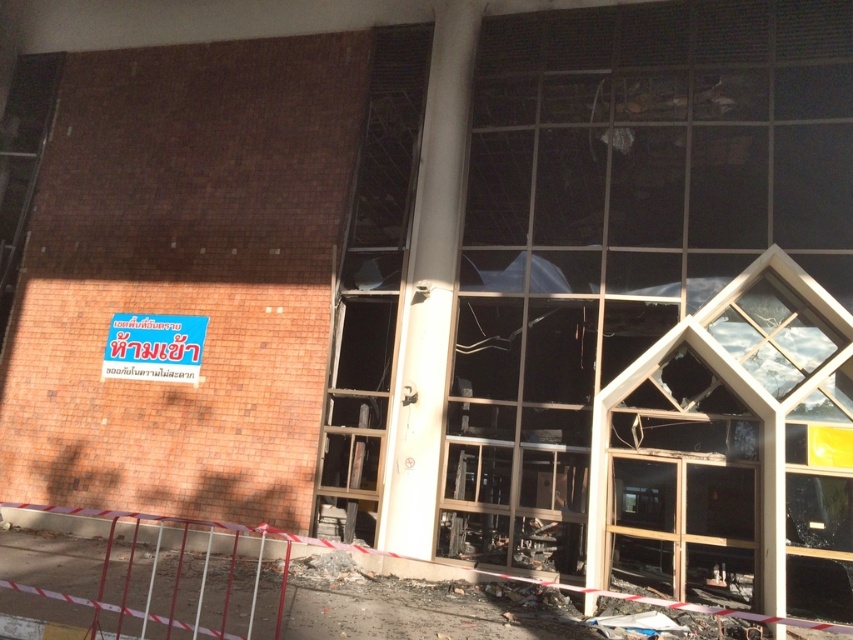
Between transparent glass door at center and blue plastic sign at upper left, which one has more height?

transparent glass door at center is taller.

Which is behind, point (375, 145) or point (143, 346)?

The point (375, 145) is more distant.

What do you see at coordinates (370, 285) in the screenshot? I see `transparent glass door at center` at bounding box center [370, 285].

This screenshot has width=853, height=640. In order to click on transparent glass door at center in this screenshot , I will do `click(370, 285)`.

Is transparent glass window at right closer to camera compared to transparent glass door at center?

Yes, transparent glass window at right is in front of transparent glass door at center.

Who is more distant from viewer, [535,426] or [341,385]?

The point [341,385] is behind.

Between point (583, 256) and point (364, 460), which one is positioned in front?

Point (583, 256) is in front.

Locate an element on the screen. The height and width of the screenshot is (640, 853). transparent glass window at right is located at coordinates (659, 301).

Between transparent glass window at right and blue plastic sign at upper left, which one is positioned lower?

Positioned lower is transparent glass window at right.

Between transparent glass window at right and blue plastic sign at upper left, which one has less height?

Standing shorter between the two is transparent glass window at right.

Does point (711, 52) come closer to viewer compared to point (187, 340)?

Yes.

Identify the location of transparent glass window at right. point(659,301).